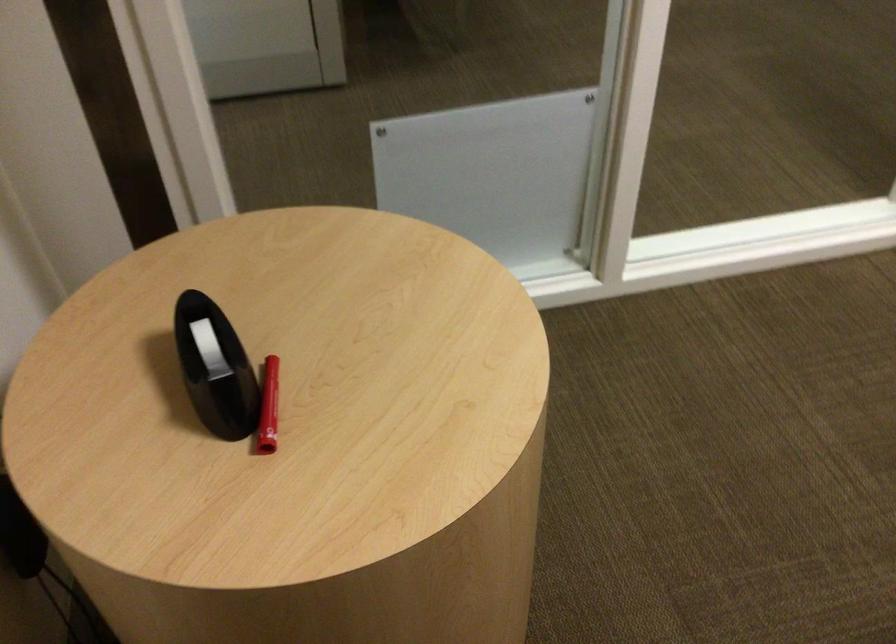
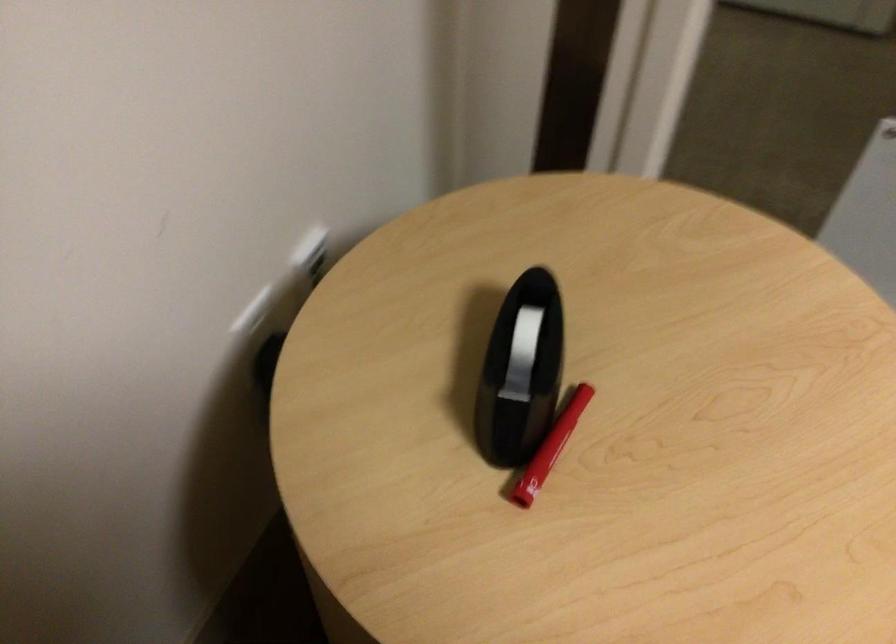
In the second image, find the point that corresponds to point 211,359 in the first image.

(521, 354)